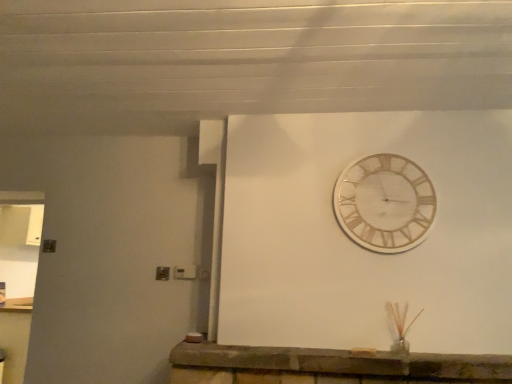
Question: Is white marble clock at upper center outside brick stone counter at lower center?

Choices:
 (A) yes
 (B) no

Answer: (A)

Question: Is white marble clock at upper center positioned before brick stone counter at lower center?

Choices:
 (A) no
 (B) yes

Answer: (A)

Question: Is white marble clock at upper center next to brick stone counter at lower center and touching it?

Choices:
 (A) no
 (B) yes

Answer: (A)

Question: From a real-world perspective, is white marble clock at upper center beneath brick stone counter at lower center?

Choices:
 (A) no
 (B) yes

Answer: (A)

Question: From the image's perspective, is white marble clock at upper center over brick stone counter at lower center?

Choices:
 (A) no
 (B) yes

Answer: (B)

Question: Is brick stone counter at lower center a part of white marble clock at upper center?

Choices:
 (A) no
 (B) yes

Answer: (A)

Question: Is brick stone counter at lower center behind white marble clock at upper center?

Choices:
 (A) no
 (B) yes

Answer: (A)

Question: Does brick stone counter at lower center have a larger size compared to white marble clock at upper center?

Choices:
 (A) no
 (B) yes

Answer: (B)

Question: Could you tell me if brick stone counter at lower center is turned towards white marble clock at upper center?

Choices:
 (A) yes
 (B) no

Answer: (B)

Question: From the image's perspective, would you say brick stone counter at lower center is shown under white marble clock at upper center?

Choices:
 (A) no
 (B) yes

Answer: (B)

Question: Is brick stone counter at lower center closer to camera compared to white marble clock at upper center?

Choices:
 (A) no
 (B) yes

Answer: (B)

Question: Considering the relative positions of brick stone counter at lower center and white marble clock at upper center in the image provided, is brick stone counter at lower center to the right of white marble clock at upper center from the viewer's perspective?

Choices:
 (A) no
 (B) yes

Answer: (A)

Question: Is white marble clock at upper center situated inside brick stone counter at lower center or outside?

Choices:
 (A) inside
 (B) outside

Answer: (B)